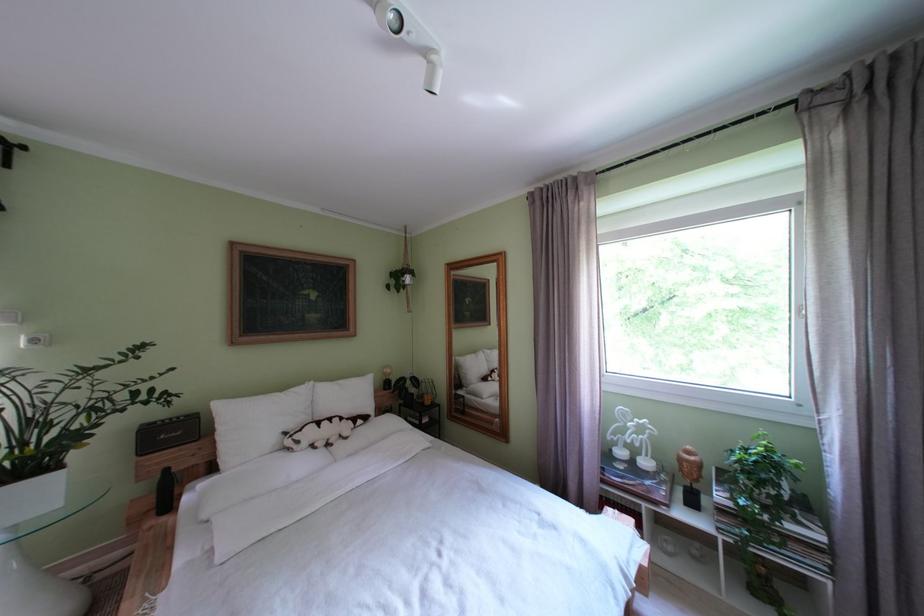
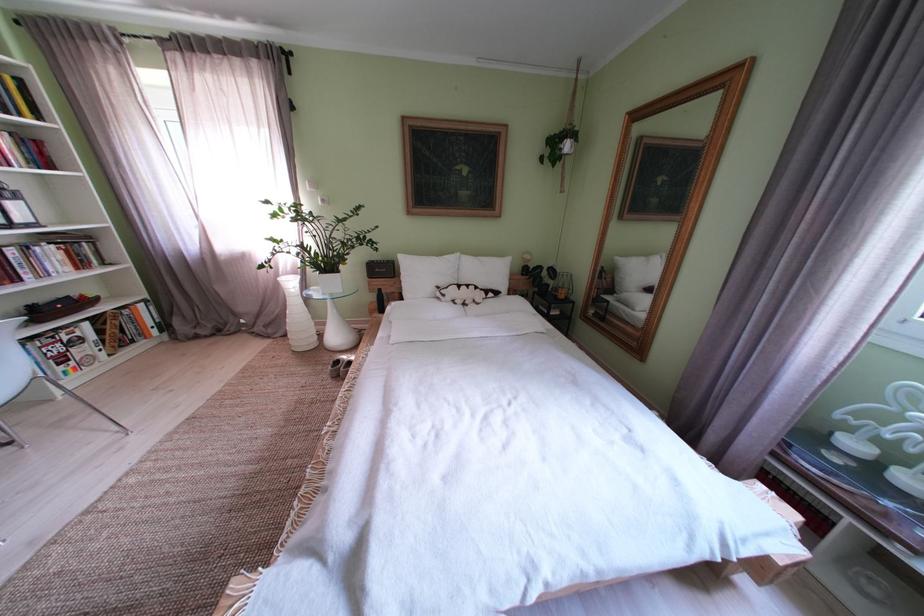
In the second image, find the point that corresponds to (x=383, y=387) in the first image.

(520, 270)